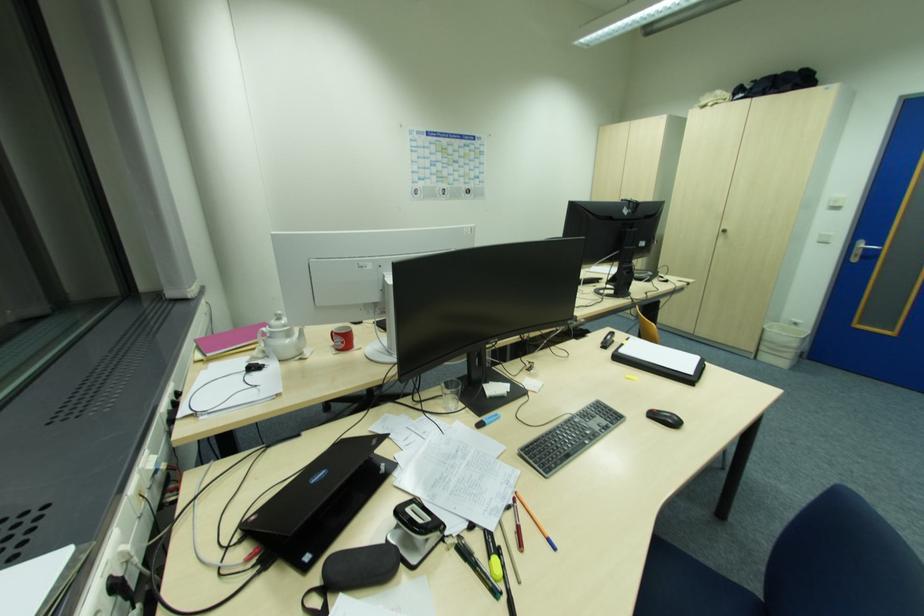
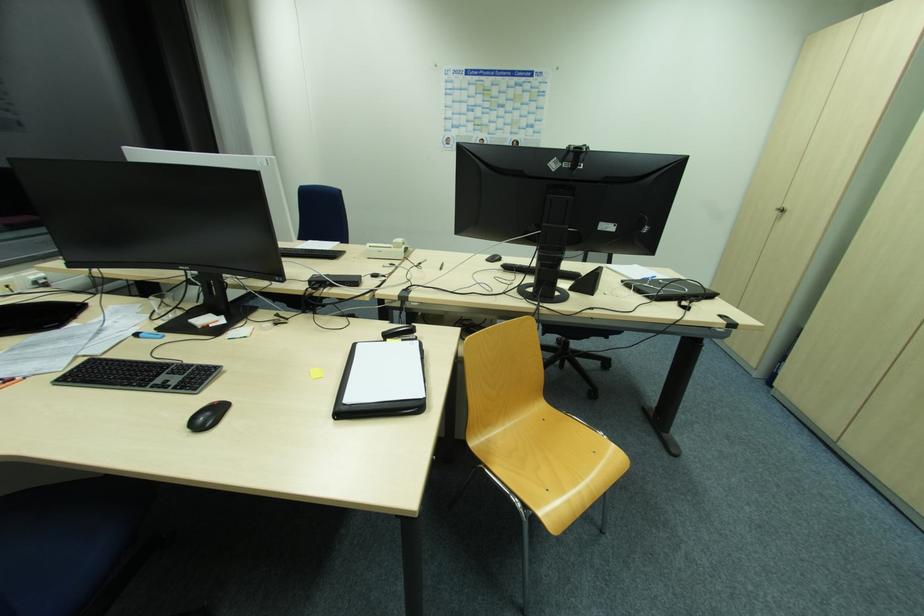
In the second image, find the point that corresponds to the point at 625,345 in the first image.

(387, 342)